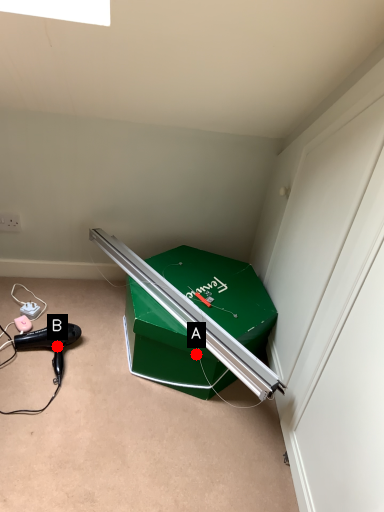
Question: Two points are circled on the image, labeled by A and B beside each circle. Which point appears closest to the camera in this image?

Choices:
 (A) A is closer
 (B) B is closer

Answer: (A)